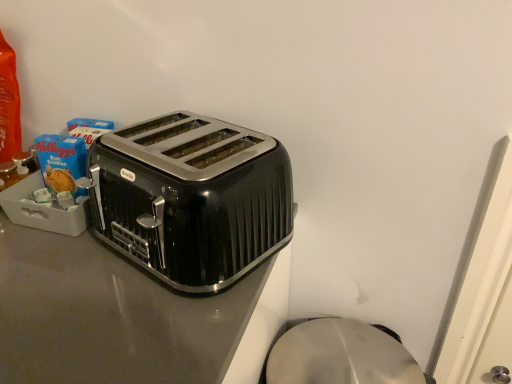
This screenshot has width=512, height=384. What are the coordinates of `black metallic toaster at center` in the screenshot? It's located at (191, 198).

What do you see at coordinates (191, 198) in the screenshot?
I see `black metallic toaster at center` at bounding box center [191, 198].

Identify the location of black glossy toaster at center. point(110,316).

What do you see at coordinates (110, 316) in the screenshot? The image size is (512, 384). I see `black glossy toaster at center` at bounding box center [110, 316].

This screenshot has height=384, width=512. Identify the location of black metallic toaster at center. (191, 198).

Considering the positions of objects black metallic toaster at center and black glossy toaster at center in the image provided, who is more to the left, black metallic toaster at center or black glossy toaster at center?

Positioned to the left is black glossy toaster at center.

Considering the positions of objects black metallic toaster at center and black glossy toaster at center in the image provided, who is behind, black metallic toaster at center or black glossy toaster at center?

Positioned behind is black metallic toaster at center.

Considering the points (275, 171) and (65, 279), which point is behind, point (275, 171) or point (65, 279)?

Positioned behind is point (275, 171).

Looking at this image, from the image's perspective, would you say black metallic toaster at center is positioned over black glossy toaster at center?

Yes.

From a real-world perspective, between black metallic toaster at center and black glossy toaster at center, who is vertically lower?

black glossy toaster at center is physically lower.

Is black metallic toaster at center thinner than black glossy toaster at center?

Yes, black metallic toaster at center is thinner than black glossy toaster at center.

Is black metallic toaster at center shorter than black glossy toaster at center?

Yes, black metallic toaster at center is shorter than black glossy toaster at center.

Is black metallic toaster at center bigger than black glossy toaster at center?

Actually, black metallic toaster at center might be smaller than black glossy toaster at center.

Can we say black metallic toaster at center lies outside black glossy toaster at center?

Yes, black metallic toaster at center is outside of black glossy toaster at center.

Can you see black metallic toaster at center touching black glossy toaster at center?

No, black metallic toaster at center is not touching black glossy toaster at center.

Does black metallic toaster at center turn towards black glossy toaster at center?

No.

How many degrees apart are the facing directions of black metallic toaster at center and black glossy toaster at center?

There is a 21.6-degree angle between the facing directions of black metallic toaster at center and black glossy toaster at center.

Identify the location of toaster lying above the black glossy toaster at center (from the image's perspective). Image resolution: width=512 pixels, height=384 pixels. (191, 198).

Based on the photo, which object is positioned more to the right, black glossy toaster at center or black metallic toaster at center?

black metallic toaster at center.

Considering their positions, is black glossy toaster at center located in front of or behind black metallic toaster at center?

In the image, black glossy toaster at center appears in front of black metallic toaster at center.

Is point (41, 263) closer or farther from the camera than point (190, 142)?

Clearly, point (41, 263) is closer to the camera than point (190, 142).

From the image's perspective, is black glossy toaster at center located above or below black metallic toaster at center?

From the image's perspective, black glossy toaster at center appears below black metallic toaster at center.

From a real-world perspective, who is located lower, black glossy toaster at center or black metallic toaster at center?

black glossy toaster at center, from a real-world perspective.

Considering the sizes of black glossy toaster at center and black metallic toaster at center in the image, is black glossy toaster at center wider or thinner than black metallic toaster at center?

black glossy toaster at center is wider than black metallic toaster at center.

Between black glossy toaster at center and black metallic toaster at center, which one has more height?

black glossy toaster at center is taller.

Is black glossy toaster at center bigger than black metallic toaster at center?

Correct, black glossy toaster at center is larger in size than black metallic toaster at center.

Would you say black metallic toaster at center is part of black glossy toaster at center's contents?

No, black metallic toaster at center is not a part of black glossy toaster at center.

Looking at this image, would you consider black glossy toaster at center to be distant from black metallic toaster at center?

That's not correct — black glossy toaster at center is a little close to black metallic toaster at center.

Is black glossy toaster at center turned away from black metallic toaster at center?

No, black glossy toaster at center is not facing away from black metallic toaster at center.

How far apart are black glossy toaster at center and black metallic toaster at center?

black glossy toaster at center is 4.95 inches away from black metallic toaster at center.

At what (x,y) coordinates should I click in order to perform the action: click on toaster above the black glossy toaster at center (from a real-world perspective). Please return your answer as a coordinate pair (x, y). Looking at the image, I should click on (191, 198).

In order to click on toaster above the black glossy toaster at center (from the image's perspective) in this screenshot , I will do [191, 198].

Where is `counter top to the left of black metallic toaster at center`? counter top to the left of black metallic toaster at center is located at coordinates (110, 316).